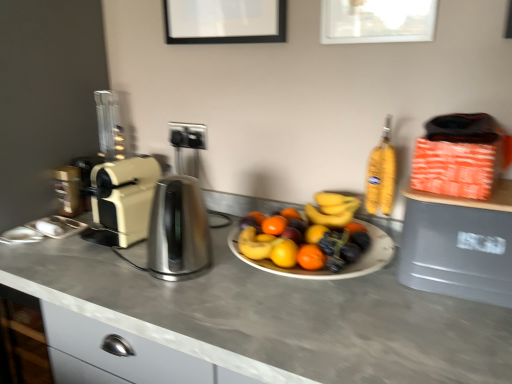
Find the location of a particular element. The image size is (512, 384). gray plastic trash can at right is located at coordinates (459, 245).

Describe the element at coordinates (68, 190) in the screenshot. I see `metallic silver coffee machine at left` at that location.

Where is `gray plastic trash can at right`? The image size is (512, 384). gray plastic trash can at right is located at coordinates (459, 245).

Between satin silver kettle at center and smooth gray countertop at center, which one has smaller size?

With smaller size is satin silver kettle at center.

Can you confirm if satin silver kettle at center is taller than smooth gray countertop at center?

Incorrect, the height of satin silver kettle at center is not larger of that of smooth gray countertop at center.

Is satin silver kettle at center next to smooth gray countertop at center?

No, satin silver kettle at center is not beside smooth gray countertop at center.

Where is `countertop in front of the satin silver kettle at center`? This screenshot has height=384, width=512. countertop in front of the satin silver kettle at center is located at coordinates pos(277,317).

Is satin silver kettle at center bigger or smaller than gray plastic trash can at right?

Considering their sizes, satin silver kettle at center takes up less space than gray plastic trash can at right.

Which object is positioned more to the left, satin silver kettle at center or gray plastic trash can at right?

Positioned to the left is satin silver kettle at center.

Does satin silver kettle at center have a lesser height compared to gray plastic trash can at right?

In fact, satin silver kettle at center may be taller than gray plastic trash can at right.

Is gray plastic trash can at right at the right side of smooth gray countertop at center?

Yes, gray plastic trash can at right is to the right of smooth gray countertop at center.

From the picture: Is gray plastic trash can at right oriented towards smooth gray countertop at center?

No, gray plastic trash can at right is not turned towards smooth gray countertop at center.

Which of these two, gray plastic trash can at right or smooth gray countertop at center, stands taller?

With more height is smooth gray countertop at center.

Considering the positions of point (198, 329) and point (411, 209), is point (198, 329) closer or farther from the camera than point (411, 209)?

Point (198, 329).

I want to click on countertop below the gray plastic trash can at right (from a real-world perspective), so click(x=277, y=317).

Considering the sizes of objects smooth gray countertop at center and gray plastic trash can at right in the image provided, who is smaller, smooth gray countertop at center or gray plastic trash can at right?

With smaller size is gray plastic trash can at right.

Is smooth gray countertop at center not near gray plastic trash can at right?

No, smooth gray countertop at center is in close proximity to gray plastic trash can at right.

Based on the photo, is beige plastic toaster at left aimed at satin silver kettle at center?

No, beige plastic toaster at left is not oriented towards satin silver kettle at center.

Consider the image. From a real-world perspective, is beige plastic toaster at left beneath satin silver kettle at center?

No.

Which object is further away from the camera, beige plastic toaster at left or satin silver kettle at center?

beige plastic toaster at left.

Which object is wider, beige plastic toaster at left or satin silver kettle at center?

Wider between the two is beige plastic toaster at left.

Who is taller, smooth gray countertop at center or beige plastic toaster at left?

smooth gray countertop at center.

From a real-world perspective, is smooth gray countertop at center physically above beige plastic toaster at left?

No, from a real-world perspective, smooth gray countertop at center is not over beige plastic toaster at left

Does point (337, 325) come closer to viewer compared to point (110, 241)?

Yes, it is in front of point (110, 241).

Is smooth gray countertop at center located outside beige plastic toaster at left?

Yes, smooth gray countertop at center is located beyond the bounds of beige plastic toaster at left.

In terms of width, does satin silver kettle at center look wider or thinner when compared to metallic silver coffee machine at left?

satin silver kettle at center is wider than metallic silver coffee machine at left.

Is satin silver kettle at center surrounding metallic silver coffee machine at left?

Definitely not — metallic silver coffee machine at left is not inside satin silver kettle at center.

Is point (172, 250) behind point (79, 207)?

No, it is not.

I want to click on kitchen appliance positioned vertically above the smooth gray countertop at center (from a real-world perspective), so click(x=178, y=231).

Find the location of a particular element. This screenshot has height=384, width=512. kitchen appliance on the left of the gray plastic trash can at right is located at coordinates (178, 231).

Looking at the image, which one is located closer to satin silver kettle at center, metallic silver coffee machine at left or beige plastic toaster at left?

The object closer to satin silver kettle at center is beige plastic toaster at left.

Estimate the real-world distances between objects in this image. Which object is closer to satin silver kettle at center, smooth gray countertop at center or beige plastic toaster at left?

Based on the image, beige plastic toaster at left appears to be nearer to satin silver kettle at center.

Based on the photo, based on their spatial positions, is smooth gray countertop at center or metallic silver coffee machine at left closer to gray plastic trash can at right?

Among the two, smooth gray countertop at center is located nearer to gray plastic trash can at right.

Looking at the image, which one is located closer to beige plastic toaster at left, metallic silver coffee machine at left or satin silver kettle at center?

satin silver kettle at center is closer to beige plastic toaster at left.

From the image, which object appears to be farther from gray plastic trash can at right, metallic silver coffee machine at left or beige plastic toaster at left?

metallic silver coffee machine at left lies further to gray plastic trash can at right than the other object.

Estimate the real-world distances between objects in this image. Which object is closer to gray plastic trash can at right, satin silver kettle at center or beige plastic toaster at left?

satin silver kettle at center.

From the image, which object appears to be nearer to beige plastic toaster at left, smooth gray countertop at center or gray plastic trash can at right?

smooth gray countertop at center lies closer to beige plastic toaster at left than the other object.

Based on their spatial positions, is smooth gray countertop at center or beige plastic toaster at left further from metallic silver coffee machine at left?

Based on the image, smooth gray countertop at center appears to be further to metallic silver coffee machine at left.

At what (x,y) coordinates should I click in order to perform the action: click on toaster between satin silver kettle at center and metallic silver coffee machine at left along the z-axis. Please return your answer as a coordinate pair (x, y). The image size is (512, 384). Looking at the image, I should click on (122, 200).

You are a GUI agent. You are given a task and a screenshot of the screen. Output one action in this format:
    pyautogui.click(x=<x>, y=<y>)
    Task: Click on the toaster between smooth gray countertop at center and metallic silver coffee machine at left from front to back
    This screenshot has width=512, height=384.
    Given the screenshot: What is the action you would take?
    pyautogui.click(x=122, y=200)

Locate an element on the screen. countertop situated between beige plastic toaster at left and gray plastic trash can at right from left to right is located at coordinates (277, 317).

The height and width of the screenshot is (384, 512). In order to click on kitchen appliance between beige plastic toaster at left and gray plastic trash can at right from left to right in this screenshot , I will do `click(178, 231)`.